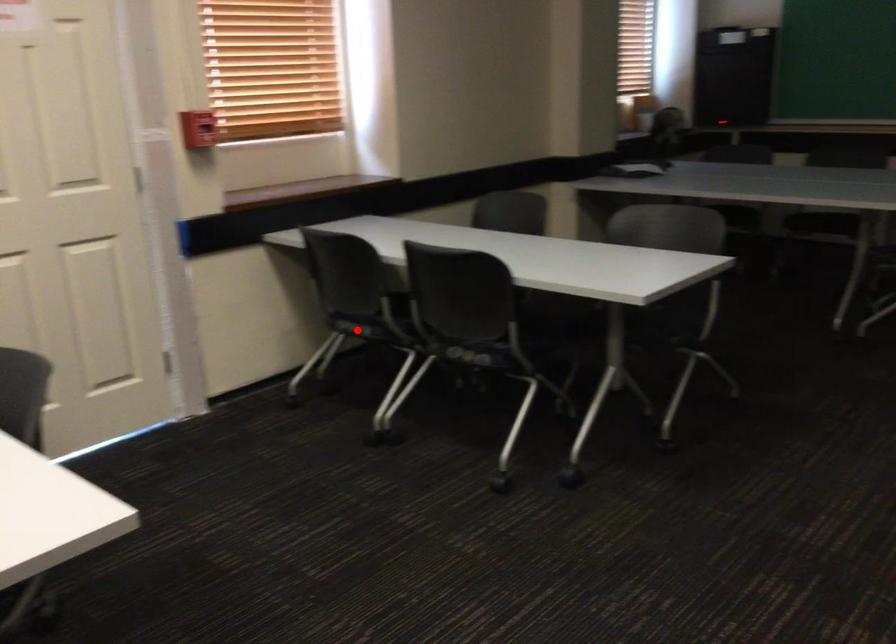
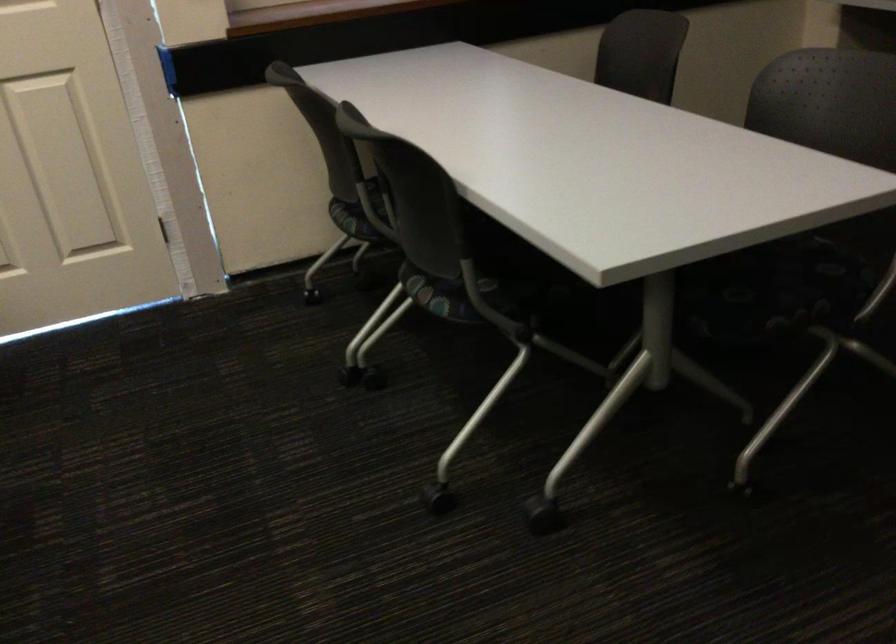
Question: I am providing you with two images of the same scene from different viewpoints. A red point is shown in image1. For the corresponding object point in image2, is it positioned nearer or farther from the camera?

Choices:
 (A) Nearer
 (B) Farther

Answer: (A)